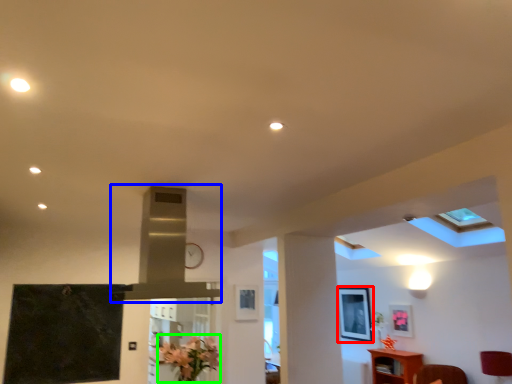
Question: Estimate the real-world distances between objects in this image. Which object is farther from picture frame (highlighted by a red box), exhaust hood (highlighted by a blue box) or flower (highlighted by a green box)?

Choices:
 (A) exhaust hood
 (B) flower

Answer: (A)